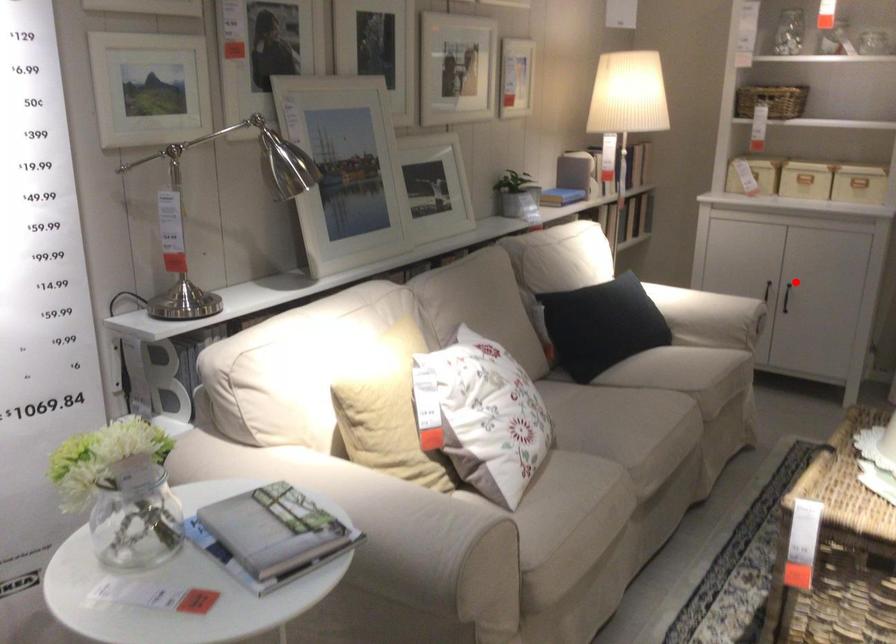
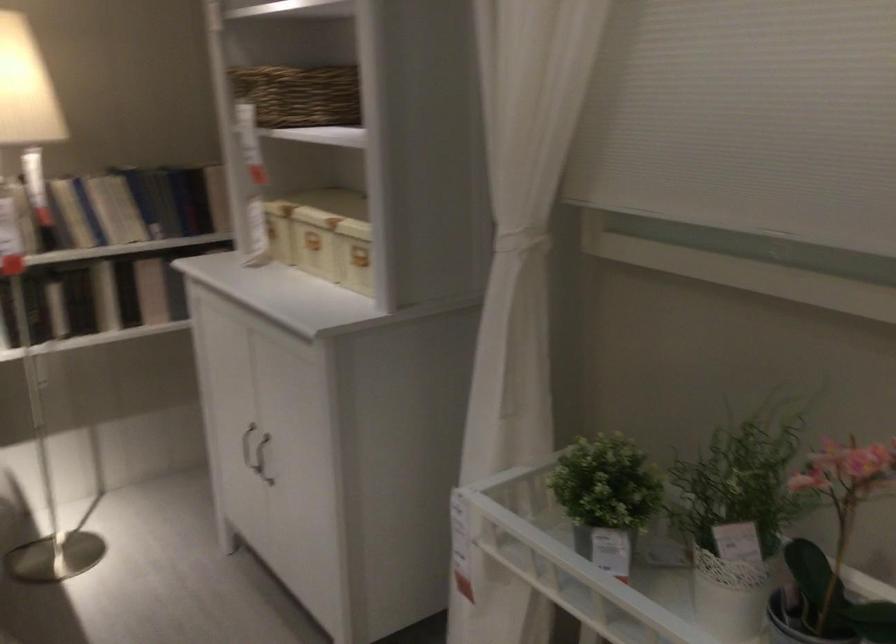
Question: I am providing you with two images of the same scene from different viewpoints. Image1 has a red point marked. In image2, the corresponding 3D location appears at what relative position? Reply with the corresponding letter.

Choices:
 (A) Closer
 (B) Farther

Answer: (A)